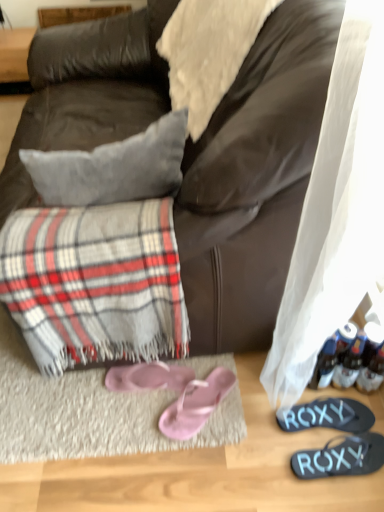
Where is `pink fabric flip-flops at lower center, which is counted as the 4th footwear, starting from the right`? pink fabric flip-flops at lower center, which is counted as the 4th footwear, starting from the right is located at coordinates (148, 377).

In order to face pink fabric flip-flops at lower center, which appears as the first footwear when viewed from the left, should I rotate leftwards or rightwards?

Turn left by 5.592 degrees to look at pink fabric flip-flops at lower center, which appears as the first footwear when viewed from the left.

At what (x,y) coordinates should I click in order to perform the action: click on pink satin flip-flops at lower center, which is the 3th footwear in right-to-left order. Please return your answer as a coordinate pair (x, y). The image size is (384, 512). Looking at the image, I should click on (196, 404).

The image size is (384, 512). Describe the element at coordinates (208, 52) in the screenshot. I see `white fuzzy blanket at upper center` at that location.

The image size is (384, 512). What do you see at coordinates (95, 283) in the screenshot? I see `plaid fabric at lower left` at bounding box center [95, 283].

Identify the location of dark brown leather couch at center. The width and height of the screenshot is (384, 512). [255, 178].

Where is `pink fabric flip-flops at lower center, which appears as the first footwear when viewed from the left`? The width and height of the screenshot is (384, 512). pink fabric flip-flops at lower center, which appears as the first footwear when viewed from the left is located at coordinates (148, 377).

Is point (197, 415) farther from viewer compared to point (137, 303)?

Yes, point (197, 415) is farther from viewer.

From a real-world perspective, does pink satin flip-flops at lower center, which is the 3th footwear in right-to-left order, stand above plaid fabric at lower left?

No, from a real-world perspective, pink satin flip-flops at lower center, which is the 3th footwear in right-to-left order, is not above plaid fabric at lower left.

Is pink satin flip-flops at lower center, which is the 3th footwear in right-to-left order, positioned with its back to plaid fabric at lower left?

No, pink satin flip-flops at lower center, which is the 3th footwear in right-to-left order, is not facing away from plaid fabric at lower left.

Consider the image. Measure the distance between dark brown leather couch at center and black rubber flip-flops at lower right, the third footwear in the left-to-right sequence.

They are 3.89 feet apart.

Is dark brown leather couch at center thinner than black rubber flip-flops at lower right, marked as the second footwear in a right-to-left arrangement?

No, dark brown leather couch at center is not thinner than black rubber flip-flops at lower right, marked as the second footwear in a right-to-left arrangement.

Is dark brown leather couch at center not close to black rubber flip-flops at lower right, the third footwear in the left-to-right sequence?

Yes, dark brown leather couch at center and black rubber flip-flops at lower right, the third footwear in the left-to-right sequence, are located far from each other.

Could you tell me if dark brown leather couch at center is facing black rubber flip-flops at lower right, marked as the second footwear in a right-to-left arrangement?

No, dark brown leather couch at center does not turn towards black rubber flip-flops at lower right, marked as the second footwear in a right-to-left arrangement.

Which is closer to the camera, (58, 342) or (167, 380)?

Point (58, 342) appears to be closer to the viewer than point (167, 380).

Is plaid fabric at lower left with pink fabric flip-flops at lower center, which is counted as the 4th footwear, starting from the right?

No.

From the image's perspective, is plaid fabric at lower left located above pink fabric flip-flops at lower center, which is counted as the 4th footwear, starting from the right?

Correct, plaid fabric at lower left appears higher than pink fabric flip-flops at lower center, which is counted as the 4th footwear, starting from the right, in the image.

Considering the positions of objects plaid fabric at lower left and pink fabric flip-flops at lower center, which is counted as the 4th footwear, starting from the right, in the image provided, who is behind, plaid fabric at lower left or pink fabric flip-flops at lower center, which is counted as the 4th footwear, starting from the right,?

Positioned behind is pink fabric flip-flops at lower center, which is counted as the 4th footwear, starting from the right.

Which object is wider, white fuzzy blanket at upper center or pink fabric flip-flops at lower center, which is counted as the 4th footwear, starting from the right?

white fuzzy blanket at upper center.

You are a GUI agent. You are given a task and a screenshot of the screen. Output one action in this format:
    pyautogui.click(x=<x>, y=<y>)
    Task: Click on the cloth that appears above the pink fabric flip-flops at lower center, which is counted as the 4th footwear, starting from the right (from the image's perspective)
    This screenshot has width=384, height=512.
    Given the screenshot: What is the action you would take?
    pyautogui.click(x=208, y=52)

From a real-world perspective, is white fuzzy blanket at upper center located beneath pink fabric flip-flops at lower center, which is counted as the 4th footwear, starting from the right?

No, from a real-world perspective, white fuzzy blanket at upper center is not under pink fabric flip-flops at lower center, which is counted as the 4th footwear, starting from the right.

Does white fuzzy blanket at upper center turn towards pink fabric flip-flops at lower center, which is counted as the 4th footwear, starting from the right?

No, white fuzzy blanket at upper center is not facing towards pink fabric flip-flops at lower center, which is counted as the 4th footwear, starting from the right.

Relative to black rubber flip-flops at lower right, the third footwear in the left-to-right sequence, is black rubber flip-flops at lower right, which is the first footwear from right to left, in front or behind?

Visually, black rubber flip-flops at lower right, which is the first footwear from right to left, is located in front of black rubber flip-flops at lower right, the third footwear in the left-to-right sequence.

Can we say black rubber flip-flops at lower right, which is the first footwear from right to left, lies outside black rubber flip-flops at lower right, marked as the second footwear in a right-to-left arrangement?

Indeed, black rubber flip-flops at lower right, which is the first footwear from right to left, is completely outside black rubber flip-flops at lower right, marked as the second footwear in a right-to-left arrangement.

From the picture: Does black rubber flip-flops at lower right, which is the first footwear from right to left, have a greater height compared to black rubber flip-flops at lower right, the third footwear in the left-to-right sequence?

Yes.

Find the location of a particular element. Image resolution: width=384 pixels, height=512 pixels. cloth above the pink satin flip-flops at lower center, which is the second footwear in left-to-right order (from a real-world perspective) is located at coordinates click(208, 52).

Is pink satin flip-flops at lower center, which is the 3th footwear in right-to-left order, facing towards white fuzzy blanket at upper center?

No.

Would you say pink satin flip-flops at lower center, which is the second footwear in left-to-right order, is outside white fuzzy blanket at upper center?

Yes.

Is pink satin flip-flops at lower center, which is the second footwear in left-to-right order, in front of or behind white fuzzy blanket at upper center in the image?

Clearly, pink satin flip-flops at lower center, which is the second footwear in left-to-right order, is behind white fuzzy blanket at upper center.

From a real-world perspective, between plaid fabric at lower left and black rubber flip-flops at lower right, which is the fourth footwear in left-to-right order, who is vertically higher?

From a 3D spatial view, plaid fabric at lower left is above.

Which object is positioned more to the left, plaid fabric at lower left or black rubber flip-flops at lower right, which is the fourth footwear in left-to-right order?

Positioned to the left is plaid fabric at lower left.

Is plaid fabric at lower left not near black rubber flip-flops at lower right, which is the fourth footwear in left-to-right order?

No, plaid fabric at lower left is not far away from black rubber flip-flops at lower right, which is the fourth footwear in left-to-right order.

Image resolution: width=384 pixels, height=512 pixels. Find the location of `footwear that is the 2nd one when counting backward from the plaid fabric at lower left`. footwear that is the 2nd one when counting backward from the plaid fabric at lower left is located at coordinates (196, 404).

Find the location of a particular element. Image resolution: width=384 pixels, height=512 pixels. studio couch above the black rubber flip-flops at lower right, marked as the second footwear in a right-to-left arrangement (from the image's perspective) is located at coordinates (255, 178).

Which object lies further to the anchor point dark brown leather couch at center, pink satin flip-flops at lower center, which is the 3th footwear in right-to-left order, or white fuzzy blanket at upper center?

pink satin flip-flops at lower center, which is the 3th footwear in right-to-left order.

Looking at the image, which one is located further to pink satin flip-flops at lower center, which is the 3th footwear in right-to-left order, dark brown leather couch at center or black rubber flip-flops at lower right, which is the fourth footwear in left-to-right order?

dark brown leather couch at center lies further to pink satin flip-flops at lower center, which is the 3th footwear in right-to-left order, than the other object.

From the image, which object appears to be farther from black rubber flip-flops at lower right, the third footwear in the left-to-right sequence, pink fabric flip-flops at lower center, which is counted as the 4th footwear, starting from the right, or white fuzzy blanket at upper center?

white fuzzy blanket at upper center is positioned further to the anchor black rubber flip-flops at lower right, the third footwear in the left-to-right sequence.

Considering their positions, is pink fabric flip-flops at lower center, which appears as the first footwear when viewed from the left, positioned closer to white fuzzy blanket at upper center than dark brown leather couch at center?

dark brown leather couch at center.

From the picture: Based on their spatial positions, is black rubber flip-flops at lower right, the third footwear in the left-to-right sequence, or dark brown leather couch at center closer to pink fabric flip-flops at lower center, which appears as the first footwear when viewed from the left?

Based on the image, black rubber flip-flops at lower right, the third footwear in the left-to-right sequence, appears to be nearer to pink fabric flip-flops at lower center, which appears as the first footwear when viewed from the left.

Estimate the real-world distances between objects in this image. Which object is further from dark brown leather couch at center, black rubber flip-flops at lower right, marked as the second footwear in a right-to-left arrangement, or pink fabric flip-flops at lower center, which is counted as the 4th footwear, starting from the right?

black rubber flip-flops at lower right, marked as the second footwear in a right-to-left arrangement, lies further to dark brown leather couch at center than the other object.

When comparing their distances from black rubber flip-flops at lower right, which is the fourth footwear in left-to-right order, does plaid fabric at lower left or pink satin flip-flops at lower center, which is the second footwear in left-to-right order, seem further?

The object further to black rubber flip-flops at lower right, which is the fourth footwear in left-to-right order, is plaid fabric at lower left.

From the image, which object appears to be farther from pink satin flip-flops at lower center, which is the second footwear in left-to-right order, pink fabric flip-flops at lower center, which is counted as the 4th footwear, starting from the right, or dark brown leather couch at center?

dark brown leather couch at center.

Find the location of a particular element. The height and width of the screenshot is (512, 384). flannel between dark brown leather couch at center and pink fabric flip-flops at lower center, which appears as the first footwear when viewed from the left, in the vertical direction is located at coordinates (95, 283).

This screenshot has height=512, width=384. Identify the location of flannel between dark brown leather couch at center and pink satin flip-flops at lower center, which is the 3th footwear in right-to-left order, in the vertical direction. (95, 283).

Find the location of a particular element. The height and width of the screenshot is (512, 384). studio couch between white fuzzy blanket at upper center and pink satin flip-flops at lower center, which is the 3th footwear in right-to-left order, vertically is located at coordinates (255, 178).

You are a GUI agent. You are given a task and a screenshot of the screen. Output one action in this format:
    pyautogui.click(x=<x>, y=<y>)
    Task: Click on the footwear between pink satin flip-flops at lower center, which is the 3th footwear in right-to-left order, and black rubber flip-flops at lower right, which is the fourth footwear in left-to-right order
    The width and height of the screenshot is (384, 512).
    Given the screenshot: What is the action you would take?
    pyautogui.click(x=327, y=415)